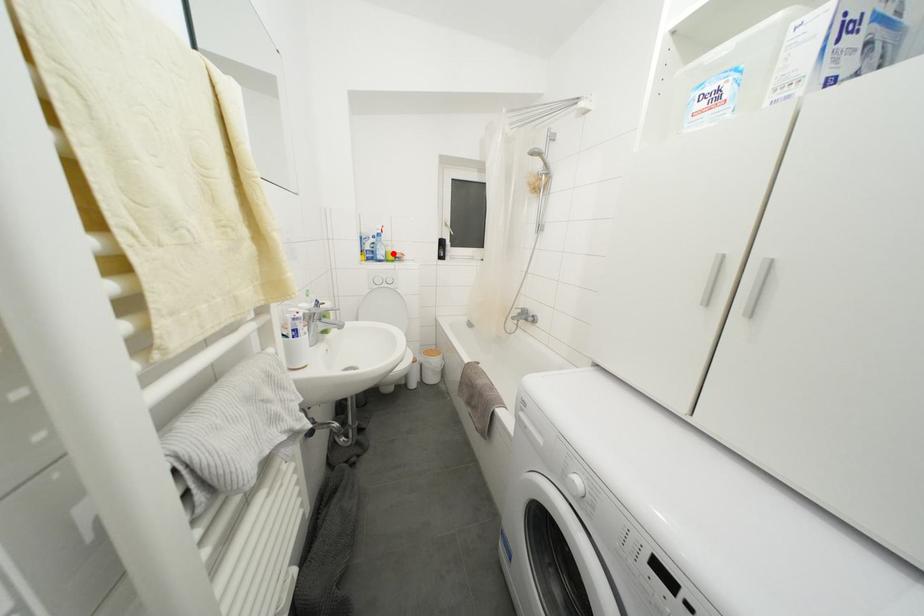
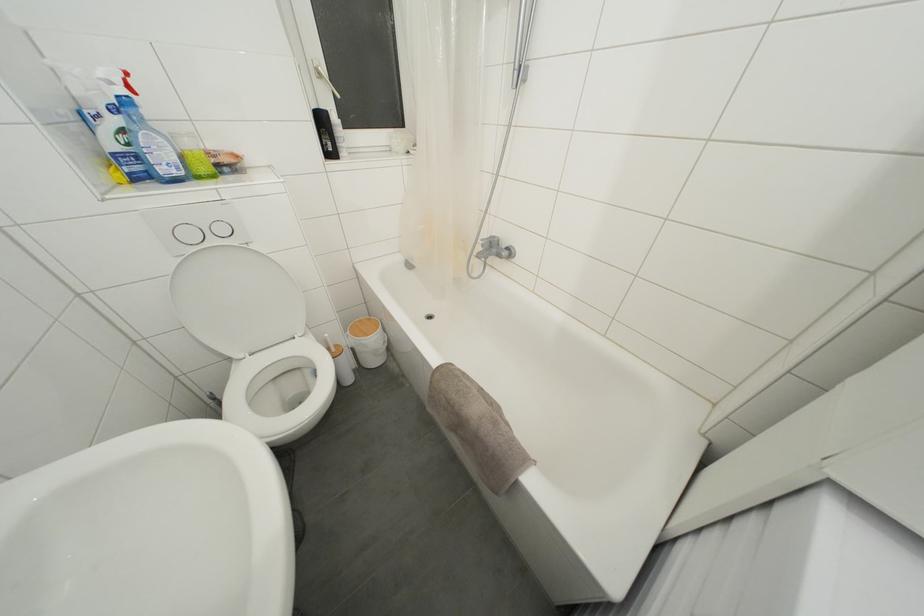
Question: I am providing you with two images of the same scene from different viewpoints. A red point is marked on the first image. Is the red point's position out of view in image 2?

Choices:
 (A) Yes
 (B) No

Answer: (B)